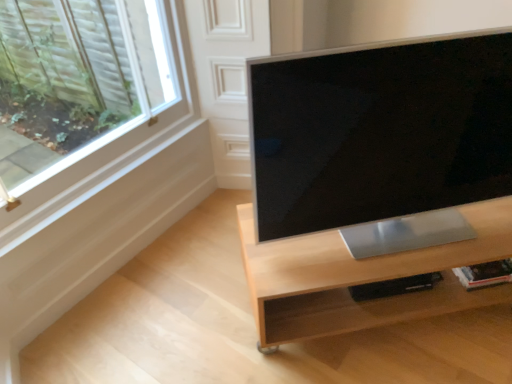
Question: From the image's perspective, is silver metallic computer monitor at center above or below light wood/finish tv stand at center?

Choices:
 (A) above
 (B) below

Answer: (A)

Question: Considering the relative positions of silver metallic computer monitor at center and light wood/finish tv stand at center in the image provided, is silver metallic computer monitor at center to the left or to the right of light wood/finish tv stand at center?

Choices:
 (A) right
 (B) left

Answer: (B)

Question: Would you say silver metallic computer monitor at center is inside or outside light wood/finish tv stand at center?

Choices:
 (A) outside
 (B) inside

Answer: (A)

Question: Looking at the image, does light wood/finish tv stand at center seem bigger or smaller compared to silver metallic computer monitor at center?

Choices:
 (A) big
 (B) small

Answer: (A)

Question: From a real-world perspective, relative to silver metallic computer monitor at center, is light wood/finish tv stand at center vertically above or below?

Choices:
 (A) below
 (B) above

Answer: (A)

Question: In the image, is light wood/finish tv stand at center positioned in front of or behind silver metallic computer monitor at center?

Choices:
 (A) front
 (B) behind

Answer: (B)

Question: Does point (374, 304) appear closer or farther from the camera than point (421, 170)?

Choices:
 (A) farther
 (B) closer

Answer: (A)